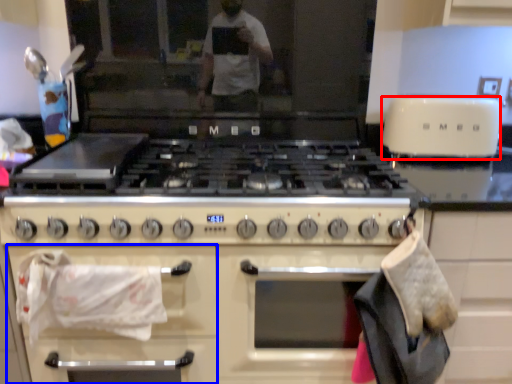
Question: Which object appears closest to the camera in this image, toaster (highlighted by a red box) or cabinetry (highlighted by a blue box)?

Choices:
 (A) toaster
 (B) cabinetry

Answer: (B)